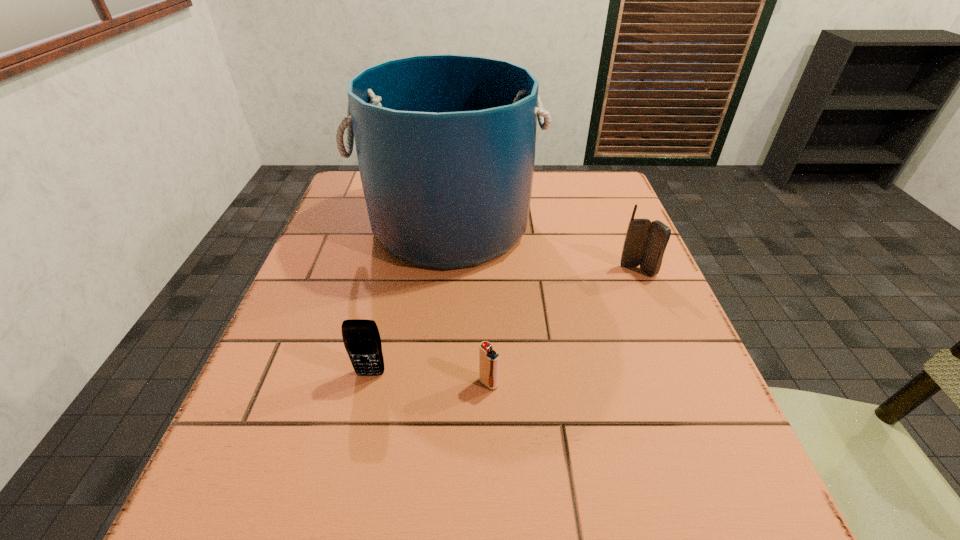
Locate an element on the screen. The height and width of the screenshot is (540, 960). object that is positioned at the far edge is located at coordinates (445, 143).

The image size is (960, 540). Identify the location of object that is at the left edge. (445, 143).

Locate an element on the screen. The width and height of the screenshot is (960, 540). object situated at the right edge is located at coordinates (645, 242).

Locate an element on the screen. This screenshot has width=960, height=540. object that is at the far left corner is located at coordinates (445, 143).

This screenshot has height=540, width=960. Identify the location of vacant area at the left edge. (337, 259).

Where is `vacant space at the right edge`? vacant space at the right edge is located at coordinates (696, 436).

Find the location of `free spot at the far left corner of the desktop`. free spot at the far left corner of the desktop is located at coordinates (354, 178).

In the image, there is a desktop. At what (x,y) coordinates should I click in order to perform the action: click on free region at the near left corner. Please return your answer as a coordinate pair (x, y). Image resolution: width=960 pixels, height=540 pixels. Looking at the image, I should click on (302, 511).

Locate an element on the screen. This screenshot has height=540, width=960. vacant space at the far right corner of the desktop is located at coordinates (605, 196).

Where is `vacant space that's between the shorter cellular telephone and the igniter`? vacant space that's between the shorter cellular telephone and the igniter is located at coordinates (429, 379).